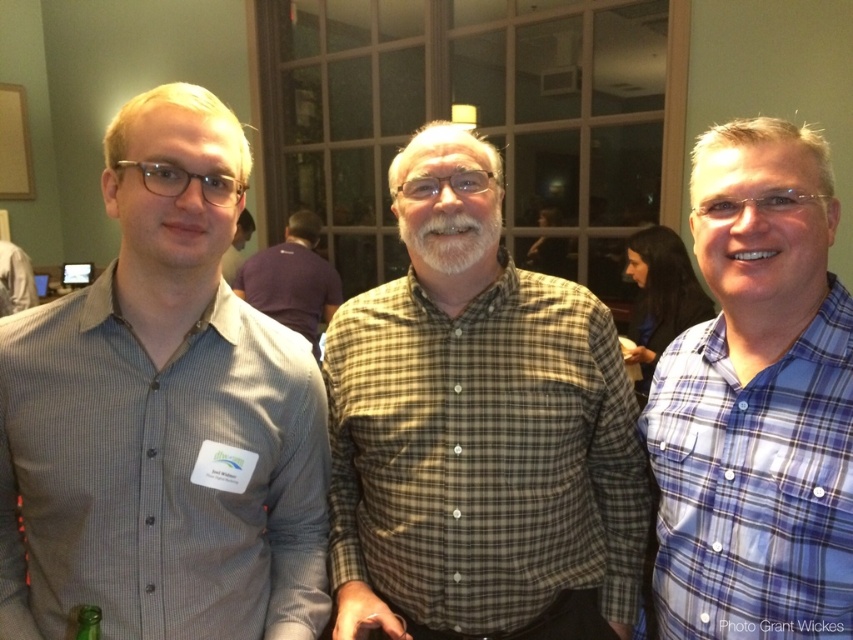
You are a photographer at the event and need to capture a photo of the green glass bottle at lower left without the brown plaid shirt at center blocking it. How should you adjust your camera position?

Move the camera to the side so that the green glass bottle at lower left is no longer behind the brown plaid shirt at center.

You are a photographer at the event and need to capture a photo of the plaid shirt at center and the green glass bottle at lower left. Since the bottle is shorter, where should you position your camera to ensure both are in focus?

The plaid shirt at center is taller than the green glass bottle at lower left, so positioning the camera at eye level with the plaid shirt at center will ensure both objects are in focus as the bottle will naturally be within the same focal plane.